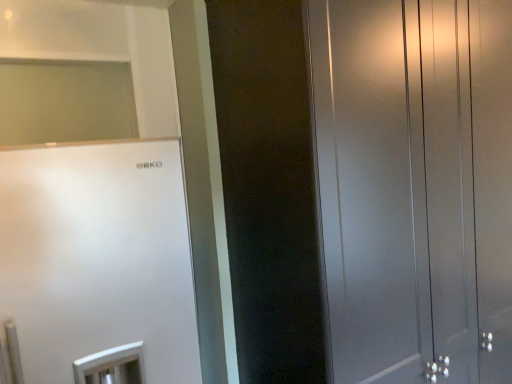
Describe the element at coordinates (98, 259) in the screenshot. This screenshot has height=384, width=512. I see `satin white fridge at left` at that location.

Identify the location of satin white fridge at left. The width and height of the screenshot is (512, 384). (98, 259).

Measure the distance between point (325, 152) and camera.

A distance of 4.19 feet exists between point (325, 152) and camera.

Identify the location of satin black wardrobe at right. The height and width of the screenshot is (384, 512). (413, 178).

The height and width of the screenshot is (384, 512). What do you see at coordinates (413, 178) in the screenshot?
I see `satin black wardrobe at right` at bounding box center [413, 178].

This screenshot has height=384, width=512. I want to click on satin white fridge at left, so click(98, 259).

Which object is positioned more to the right, satin black wardrobe at right or satin white fridge at left?

From the viewer's perspective, satin black wardrobe at right appears more on the right side.

From the picture: Does satin black wardrobe at right lie behind satin white fridge at left?

Yes, satin black wardrobe at right is behind satin white fridge at left.

Is point (439, 43) positioned in front of point (147, 172)?

No, (439, 43) is further to viewer.

From the image's perspective, is satin black wardrobe at right above satin white fridge at left?

Yes.

From a real-world perspective, who is located lower, satin black wardrobe at right or satin white fridge at left?

satin white fridge at left, from a real-world perspective.

Is satin black wardrobe at right thinner than satin white fridge at left?

Yes, satin black wardrobe at right is thinner than satin white fridge at left.

Is satin black wardrobe at right taller or shorter than satin white fridge at left?

In the image, satin black wardrobe at right appears to be taller than satin white fridge at left.

Is satin black wardrobe at right bigger or smaller than satin white fridge at left?

satin black wardrobe at right is bigger than satin white fridge at left.

Is satin black wardrobe at right inside the boundaries of satin white fridge at left, or outside?

satin black wardrobe at right is not enclosed by satin white fridge at left.

Are satin black wardrobe at right and satin white fridge at left beside each other?

satin black wardrobe at right is not next to satin white fridge at left, and they're not touching.

Is satin black wardrobe at right looking in the opposite direction of satin white fridge at left?

No, satin white fridge at left is not at the back of satin black wardrobe at right.

What's the angular difference between satin black wardrobe at right and satin white fridge at left's facing directions?

They differ by 1.51 degrees in their facing directions.

The image size is (512, 384). What are the coordinates of `refrigerator on the left side of satin black wardrobe at right` in the screenshot? It's located at (98, 259).

Visually, is satin white fridge at left positioned to the left or to the right of satin black wardrobe at right?

Based on their positions, satin white fridge at left is located to the left of satin black wardrobe at right.

In the scene shown: Which object is further away from the camera, satin white fridge at left or satin black wardrobe at right?

satin black wardrobe at right is behind.

Is point (6, 292) closer or farther from the camera than point (374, 187)?

Point (6, 292) is positioned closer to the camera compared to point (374, 187).

From the image's perspective, which is above, satin white fridge at left or satin black wardrobe at right?

satin black wardrobe at right is shown above in the image.

From a real-world perspective, which object stands above the other?

satin black wardrobe at right, from a real-world perspective.

Is satin white fridge at left wider than satin black wardrobe at right?

Yes, satin white fridge at left is wider than satin black wardrobe at right.

Looking at this image, can you confirm if satin white fridge at left is shorter than satin black wardrobe at right?

Yes.

Considering the relative sizes of satin white fridge at left and satin black wardrobe at right in the image provided, is satin white fridge at left smaller than satin black wardrobe at right?

Yes.

Is satin white fridge at left surrounding satin black wardrobe at right?

That's incorrect, satin black wardrobe at right is not inside satin white fridge at left.

Are satin white fridge at left and satin black wardrobe at right located far from each other?

satin white fridge at left is actually quite close to satin black wardrobe at right.

Is satin white fridge at left looking in the opposite direction of satin black wardrobe at right?

No, satin white fridge at left is not facing the opposite direction of satin black wardrobe at right.

The height and width of the screenshot is (384, 512). In order to click on door that is above the satin white fridge at left (from a real-world perspective) in this screenshot , I will do `click(413, 178)`.

Locate an element on the screen. door above the satin white fridge at left (from a real-world perspective) is located at coordinates (413, 178).

Identify the location of refrigerator in front of the satin black wardrobe at right. The width and height of the screenshot is (512, 384). (98, 259).